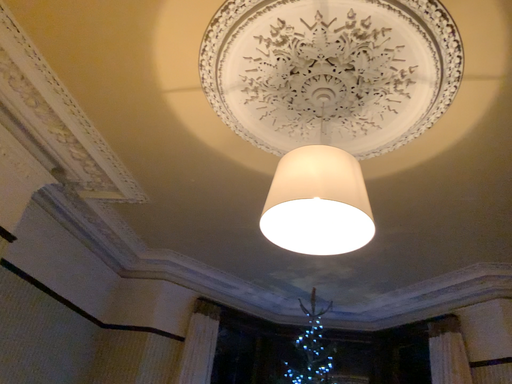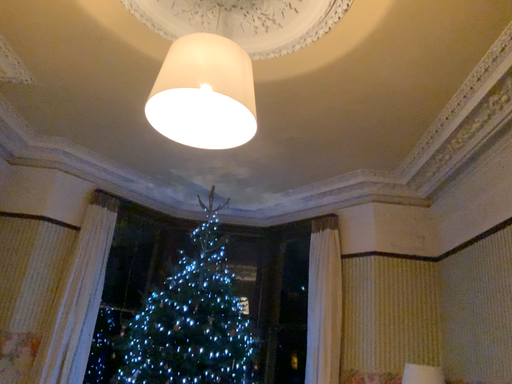
Question: Which way did the camera rotate in the video?

Choices:
 (A) rotated left
 (B) rotated right

Answer: (B)